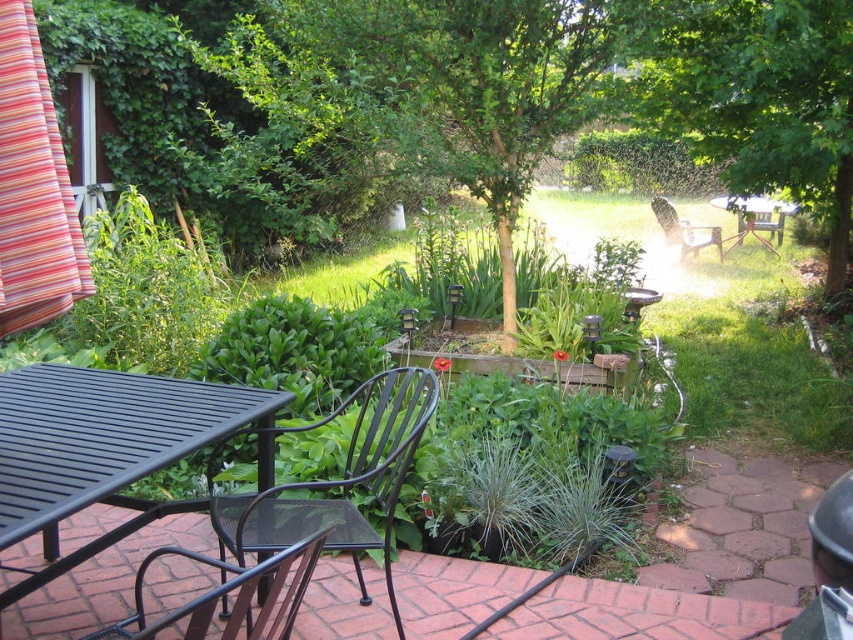
Question: Does black mesh chair at lower left appear under wooden bench at center?

Choices:
 (A) no
 (B) yes

Answer: (B)

Question: In this image, where is green leafy tree at center located relative to wooden bench at center?

Choices:
 (A) below
 (B) above

Answer: (A)

Question: Is green leafy tree at center smaller than wooden chair at center?

Choices:
 (A) yes
 (B) no

Answer: (B)

Question: Which object appears closest to the camera in this image?

Choices:
 (A) black mesh chair at lower left
 (B) green leafy tree at center

Answer: (A)

Question: Which object is the farthest from the wooden chair at center?

Choices:
 (A) black mesh chair at lower left
 (B) wooden bench at center
 (C) black mesh chair at center

Answer: (A)

Question: Which of the following is the closest to the observer?

Choices:
 (A) (654, 200)
 (B) (367, 452)

Answer: (B)